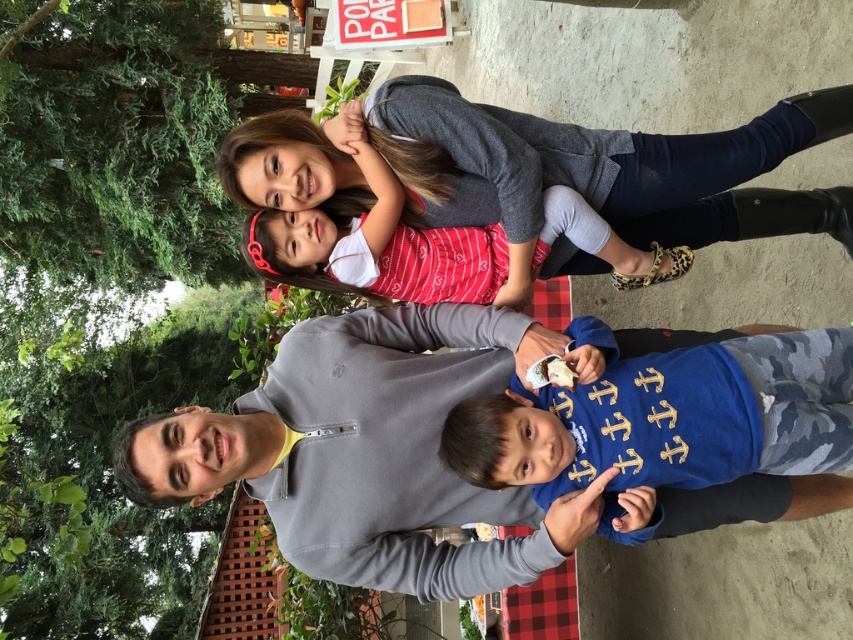
You are a photographer trying to adjust the lighting for a family photo. You notice two children wearing different shirts in the scene. The first child is wearing a red striped shirt at upper center, and the second is wearing a blue camouflage shirt at center. Which child should you position closer to the light source to ensure their face is well illuminated, considering their height?

The red striped shirt at upper center is much taller than the blue camouflage shirt at center. To ensure proper illumination, position the taller child, the one in the red striped shirt at upper center, closer to the light source so their face can be adequately lit.

What is the color of the material at the point with coordinates (368,451)?

The point at coordinates (368,451) is located on gray fleece at center, so the color is gray.